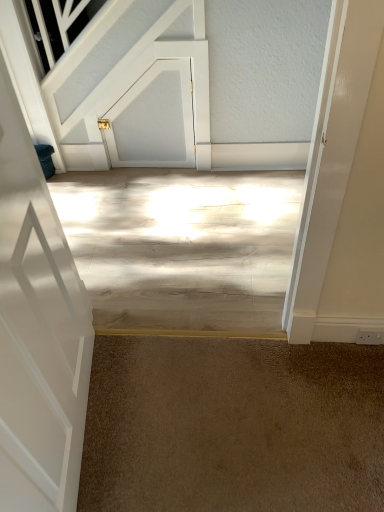
At what (x,y) coordinates should I click in order to perform the action: click on free space to the left of white matte door at upper center, the first door viewed from the back. Please return your answer as a coordinate pair (x, y). Looking at the image, I should click on pyautogui.click(x=108, y=180).